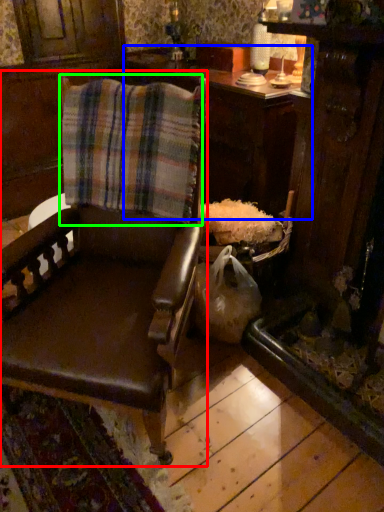
Question: Estimate the real-world distances between objects in this image. Which object is closer to chair (highlighted by a red box), table (highlighted by a blue box) or flannel (highlighted by a green box)?

Choices:
 (A) table
 (B) flannel

Answer: (B)